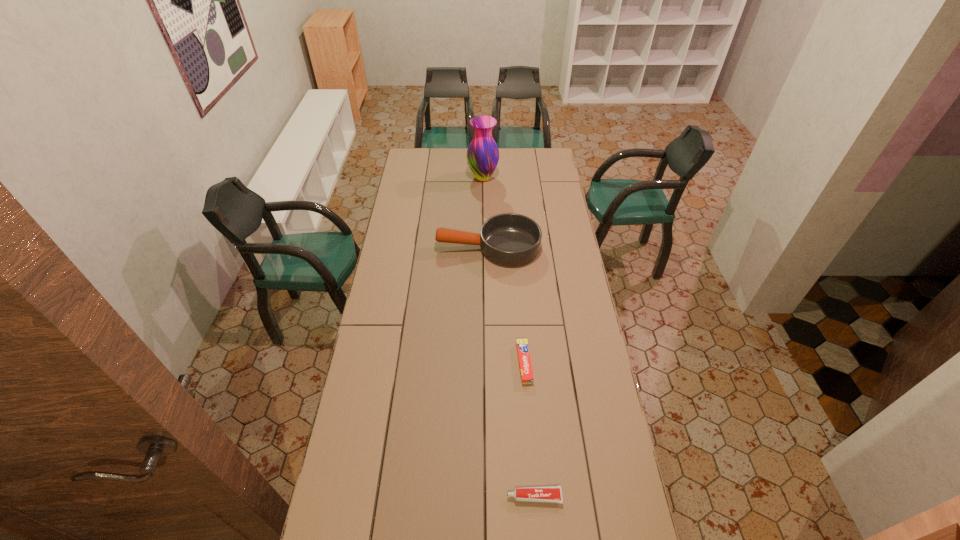
Image resolution: width=960 pixels, height=540 pixels. Identify the location of vacant space that's between the nearer toothpaste and the tallest object. (509, 337).

The image size is (960, 540). Identify the location of vacant area that lies between the nearest object and the farther toothpaste. (529, 430).

Image resolution: width=960 pixels, height=540 pixels. Identify the location of unoccupied area between the nearest object and the farther toothpaste. (529, 430).

You are a GUI agent. You are given a task and a screenshot of the screen. Output one action in this format:
    pyautogui.click(x=<x>, y=<y>)
    Task: Click on the unoccupied area between the second tallest object and the farther toothpaste
    
    Given the screenshot: What is the action you would take?
    pyautogui.click(x=506, y=305)

The height and width of the screenshot is (540, 960). I want to click on free space between the pan and the vase, so click(486, 212).

Image resolution: width=960 pixels, height=540 pixels. Identify the location of unoccupied position between the nearest object and the farthest object. (509, 337).

Find the location of `vacant space in between the third farthest object and the vase`. vacant space in between the third farthest object and the vase is located at coordinates (503, 271).

The width and height of the screenshot is (960, 540). I want to click on free space between the nearest object and the farther toothpaste, so click(529, 430).

I want to click on object that is the third closest to the vase, so click(550, 494).

Identify the location of object that ranks as the second closest to the third farthest object. This screenshot has width=960, height=540. tap(509, 239).